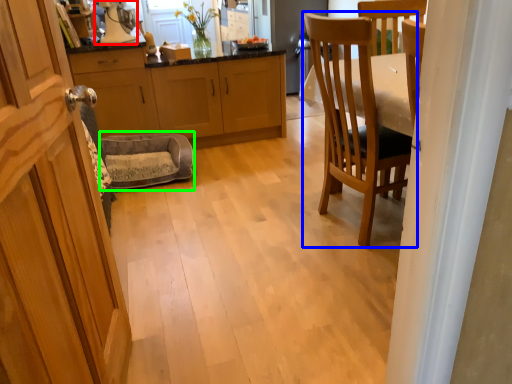
Question: Considering the real-world distances, which object is closest to appliance (highlighted by a red box)? chair (highlighted by a blue box) or rocking chair (highlighted by a green box).

Choices:
 (A) chair
 (B) rocking chair

Answer: (B)